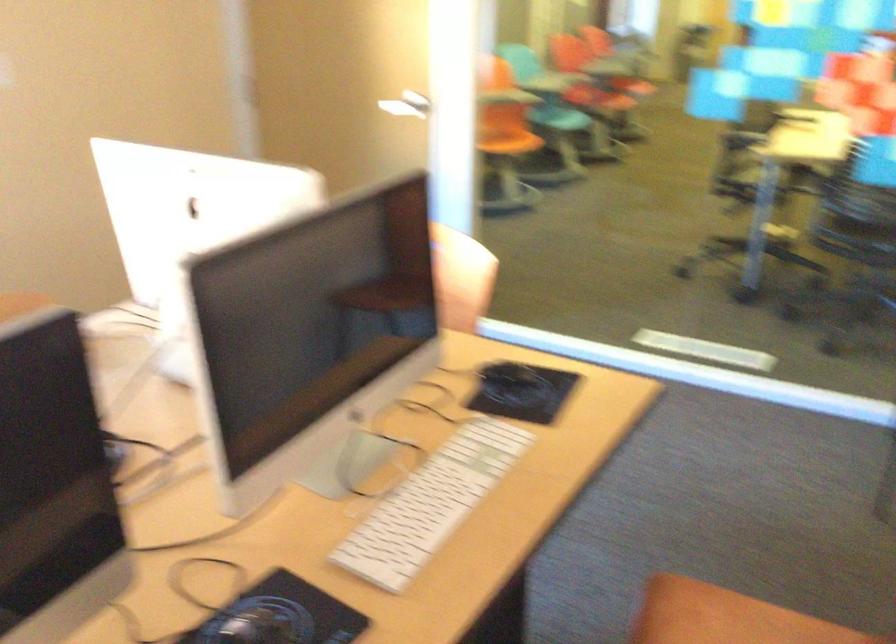
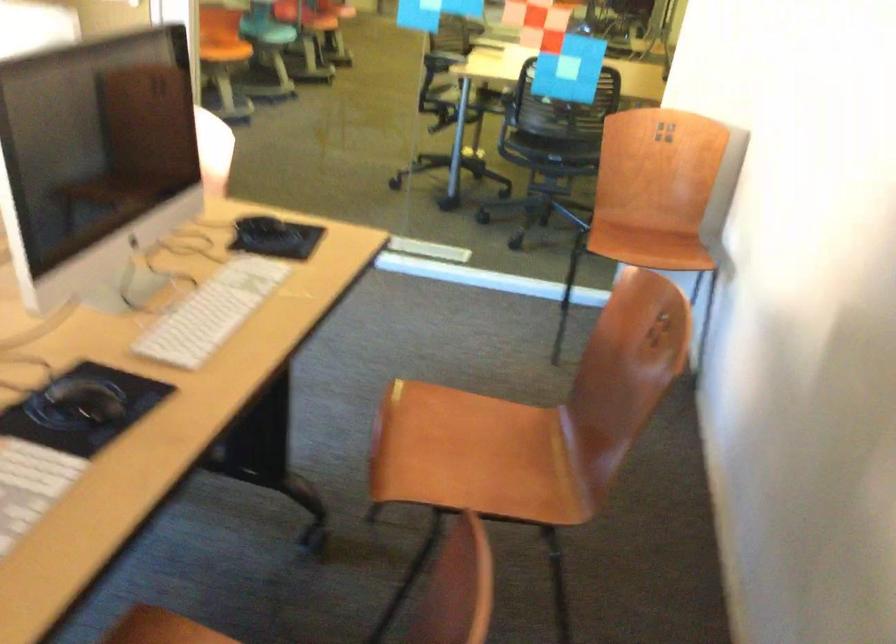
Question: The images are taken continuously from a first-person perspective. In which direction is your viewpoint rotating?

Choices:
 (A) Left
 (B) Right
 (C) Up
 (D) Down

Answer: (B)